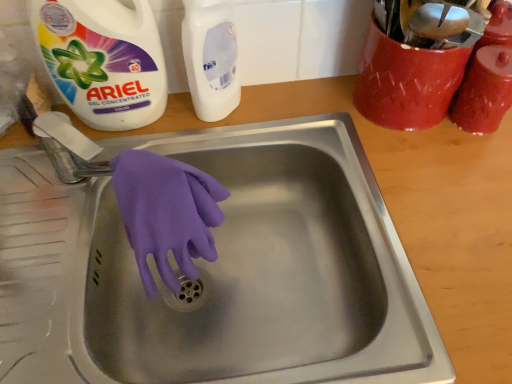
Find the location of a particular element. The image size is (512, 384). stainless steel sink at center is located at coordinates (x=219, y=271).

This screenshot has width=512, height=384. I want to click on matte red jar at upper right, the third cleaning product positioned from the left, so click(x=484, y=91).

Find the location of a particular element. This screenshot has width=512, height=384. white matte bottle at upper center, acting as the 2th cleaning product starting from the left is located at coordinates (211, 58).

Can you confirm if white matte bottle at upper center, which ranks as the 2th cleaning product in right-to-left order, is shorter than purple rubber glove at sink center?

Incorrect, the height of white matte bottle at upper center, which ranks as the 2th cleaning product in right-to-left order, does not fall short of that of purple rubber glove at sink center.

Which object is thinner, white matte bottle at upper center, which ranks as the 2th cleaning product in right-to-left order, or purple rubber glove at sink center?

Thinner between the two is white matte bottle at upper center, which ranks as the 2th cleaning product in right-to-left order.

Is white matte bottle at upper center, acting as the 2th cleaning product starting from the left, facing towards purple rubber glove at sink center?

Yes, white matte bottle at upper center, acting as the 2th cleaning product starting from the left, is turned towards purple rubber glove at sink center.

Consider the image. Between white matte bottle at upper center, which ranks as the 2th cleaning product in right-to-left order, and purple rubber glove at sink center, which one has larger size?

Bigger between the two is purple rubber glove at sink center.

Is white gel concentrated at upper left, which ranks as the 1th cleaning product in left-to-right order, positioned beyond the bounds of stainless steel sink at center?

Indeed, white gel concentrated at upper left, which ranks as the 1th cleaning product in left-to-right order, is completely outside stainless steel sink at center.

Consider the image. From the image's perspective, is white gel concentrated at upper left, which ranks as the 1th cleaning product in left-to-right order, located above stainless steel sink at center?

Correct, white gel concentrated at upper left, which ranks as the 1th cleaning product in left-to-right order, appears higher than stainless steel sink at center in the image.

Measure the distance from white gel concentrated at upper left, placed as the 3th cleaning product when sorted from right to left, to stainless steel sink at center.

white gel concentrated at upper left, placed as the 3th cleaning product when sorted from right to left, and stainless steel sink at center are 9.97 inches apart from each other.

From a real-world perspective, between white matte bottle at upper center, acting as the 2th cleaning product starting from the left, and stainless steel sink at center, who is vertically higher?

From a 3D spatial view, white matte bottle at upper center, acting as the 2th cleaning product starting from the left, is above.

Considering the relative sizes of white matte bottle at upper center, acting as the 2th cleaning product starting from the left, and stainless steel sink at center in the image provided, is white matte bottle at upper center, acting as the 2th cleaning product starting from the left, shorter than stainless steel sink at center?

Incorrect, the height of white matte bottle at upper center, acting as the 2th cleaning product starting from the left, does not fall short of that of stainless steel sink at center.

How different are the orientations of white matte bottle at upper center, which ranks as the 2th cleaning product in right-to-left order, and stainless steel sink at center in degrees?

The facing directions of white matte bottle at upper center, which ranks as the 2th cleaning product in right-to-left order, and stainless steel sink at center are 1.7 degrees apart.

In terms of width, does white matte bottle at upper center, acting as the 2th cleaning product starting from the left, look wider or thinner when compared to stainless steel sink at center?

Clearly, white matte bottle at upper center, acting as the 2th cleaning product starting from the left, has less width compared to stainless steel sink at center.

Where is `sink on the right side of white gel concentrated at upper left, which ranks as the 1th cleaning product in left-to-right order`? Image resolution: width=512 pixels, height=384 pixels. sink on the right side of white gel concentrated at upper left, which ranks as the 1th cleaning product in left-to-right order is located at coordinates (219, 271).

Is stainless steel sink at center oriented towards white gel concentrated at upper left, which ranks as the 1th cleaning product in left-to-right order?

No, stainless steel sink at center is not oriented towards white gel concentrated at upper left, which ranks as the 1th cleaning product in left-to-right order.

From a real-world perspective, is stainless steel sink at center on top of white gel concentrated at upper left, which ranks as the 1th cleaning product in left-to-right order?

No, from a real-world perspective, stainless steel sink at center is not over white gel concentrated at upper left, which ranks as the 1th cleaning product in left-to-right order

Between matte red jar at upper right, which is the 1th cleaning product from right to left, and white matte bottle at upper center, which ranks as the 2th cleaning product in right-to-left order, which one has smaller width?

With smaller width is white matte bottle at upper center, which ranks as the 2th cleaning product in right-to-left order.

Is matte red jar at upper right, which is the 1th cleaning product from right to left, positioned far away from white matte bottle at upper center, acting as the 2th cleaning product starting from the left?

No, matte red jar at upper right, which is the 1th cleaning product from right to left, is not far away from white matte bottle at upper center, acting as the 2th cleaning product starting from the left.

Considering their positions, is matte red jar at upper right, the third cleaning product positioned from the left, located in front of or behind white matte bottle at upper center, acting as the 2th cleaning product starting from the left?

Visually, matte red jar at upper right, the third cleaning product positioned from the left, is located behind white matte bottle at upper center, acting as the 2th cleaning product starting from the left.

Is white matte bottle at upper center, acting as the 2th cleaning product starting from the left, surrounded by matte red jar at upper right, which is the 1th cleaning product from right to left?

Definitely not — white matte bottle at upper center, acting as the 2th cleaning product starting from the left, is not inside matte red jar at upper right, which is the 1th cleaning product from right to left.

Does white matte bottle at upper center, which ranks as the 2th cleaning product in right-to-left order, touch matte red jar at upper right, the third cleaning product positioned from the left?

No, white matte bottle at upper center, which ranks as the 2th cleaning product in right-to-left order, is not with matte red jar at upper right, the third cleaning product positioned from the left.

Considering the positions of objects white matte bottle at upper center, which ranks as the 2th cleaning product in right-to-left order, and matte red jar at upper right, which is the 1th cleaning product from right to left, in the image provided, who is more to the left, white matte bottle at upper center, which ranks as the 2th cleaning product in right-to-left order, or matte red jar at upper right, which is the 1th cleaning product from right to left,?

white matte bottle at upper center, which ranks as the 2th cleaning product in right-to-left order.

Does point (204, 38) lie behind point (462, 113)?

No.

Which of these two, white matte bottle at upper center, acting as the 2th cleaning product starting from the left, or matte red jar at upper right, which is the 1th cleaning product from right to left, stands taller?

white matte bottle at upper center, acting as the 2th cleaning product starting from the left.

Is white matte bottle at upper center, acting as the 2th cleaning product starting from the left, inside white gel concentrated at upper left, placed as the 3th cleaning product when sorted from right to left?

No, white matte bottle at upper center, acting as the 2th cleaning product starting from the left, is not surrounded by white gel concentrated at upper left, placed as the 3th cleaning product when sorted from right to left.

Is white gel concentrated at upper left, which ranks as the 1th cleaning product in left-to-right order, facing towards white matte bottle at upper center, which ranks as the 2th cleaning product in right-to-left order?

No, white gel concentrated at upper left, which ranks as the 1th cleaning product in left-to-right order, is not facing towards white matte bottle at upper center, which ranks as the 2th cleaning product in right-to-left order.

How distant is white gel concentrated at upper left, which ranks as the 1th cleaning product in left-to-right order, from white matte bottle at upper center, acting as the 2th cleaning product starting from the left?

white gel concentrated at upper left, which ranks as the 1th cleaning product in left-to-right order, is 10.83 centimeters from white matte bottle at upper center, acting as the 2th cleaning product starting from the left.

Considering the positions of point (48, 37) and point (200, 23), is point (48, 37) closer or farther from the camera than point (200, 23)?

Point (48, 37) appears to be closer to the viewer than point (200, 23).

In order to click on glove below the white matte bottle at upper center, which ranks as the 2th cleaning product in right-to-left order (from the image's perspective) in this screenshot , I will do `click(166, 213)`.

At what (x,y) coordinates should I click in order to perform the action: click on the 3rd cleaning product positioned above the stainless steel sink at center (from the image's perspective). Please return your answer as a coordinate pair (x, y). The width and height of the screenshot is (512, 384). Looking at the image, I should click on (103, 60).

Estimate the real-world distances between objects in this image. Which object is closer to matte red jar at upper right, which is the 1th cleaning product from right to left, white matte bottle at upper center, acting as the 2th cleaning product starting from the left, or purple rubber glove at sink center?

Among the two, white matte bottle at upper center, acting as the 2th cleaning product starting from the left, is located nearer to matte red jar at upper right, which is the 1th cleaning product from right to left.

Based on their spatial positions, is matte red jar at upper right, which is the 1th cleaning product from right to left, or white gel concentrated at upper left, placed as the 3th cleaning product when sorted from right to left, closer to stainless steel sink at center?

white gel concentrated at upper left, placed as the 3th cleaning product when sorted from right to left, is closer to stainless steel sink at center.

Based on their spatial positions, is stainless steel sink at center or white matte bottle at upper center, acting as the 2th cleaning product starting from the left, further from purple rubber glove at sink center?

white matte bottle at upper center, acting as the 2th cleaning product starting from the left.

Which object lies further to the anchor point purple rubber glove at sink center, white gel concentrated at upper left, placed as the 3th cleaning product when sorted from right to left, or matte red jar at upper right, which is the 1th cleaning product from right to left?

matte red jar at upper right, which is the 1th cleaning product from right to left, is positioned further to the anchor purple rubber glove at sink center.

Considering their positions, is matte red jar at upper right, the third cleaning product positioned from the left, positioned further to purple rubber glove at sink center than stainless steel sink at center?

matte red jar at upper right, the third cleaning product positioned from the left, is further to purple rubber glove at sink center.

Which object lies nearer to the anchor point purple rubber glove at sink center, white matte bottle at upper center, acting as the 2th cleaning product starting from the left, or white gel concentrated at upper left, placed as the 3th cleaning product when sorted from right to left?

Based on the image, white gel concentrated at upper left, placed as the 3th cleaning product when sorted from right to left, appears to be nearer to purple rubber glove at sink center.

When comparing their distances from white gel concentrated at upper left, placed as the 3th cleaning product when sorted from right to left, does stainless steel sink at center or purple rubber glove at sink center seem closer?

purple rubber glove at sink center is positioned closer to the anchor white gel concentrated at upper left, placed as the 3th cleaning product when sorted from right to left.

Which object lies further to the anchor point stainless steel sink at center, white matte bottle at upper center, acting as the 2th cleaning product starting from the left, or white gel concentrated at upper left, placed as the 3th cleaning product when sorted from right to left?

white matte bottle at upper center, acting as the 2th cleaning product starting from the left, is positioned further to the anchor stainless steel sink at center.

Identify the location of glove between white gel concentrated at upper left, placed as the 3th cleaning product when sorted from right to left, and stainless steel sink at center in the up-down direction. The height and width of the screenshot is (384, 512). (x=166, y=213).

Find the location of a particular element. The height and width of the screenshot is (384, 512). glove that lies between white matte bottle at upper center, which ranks as the 2th cleaning product in right-to-left order, and stainless steel sink at center from top to bottom is located at coordinates (166, 213).

In order to click on cleaning product located between stainless steel sink at center and matte red jar at upper right, which is the 1th cleaning product from right to left, in the left-right direction in this screenshot , I will do `click(211, 58)`.

Identify the location of glove situated between stainless steel sink at center and matte red jar at upper right, which is the 1th cleaning product from right to left, from left to right. The width and height of the screenshot is (512, 384). (166, 213).